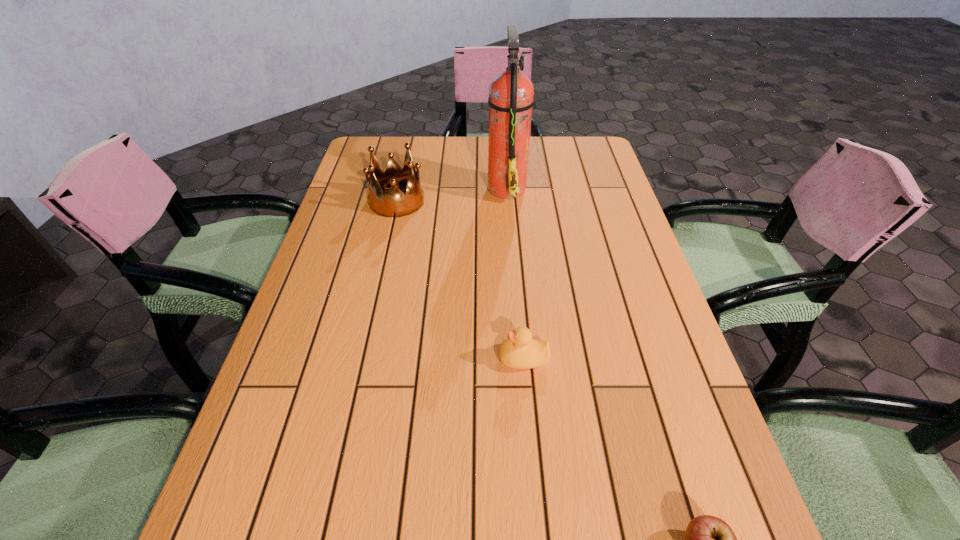
Identify the location of free space located 0.230m on the face of the duck. The width and height of the screenshot is (960, 540). (384, 358).

Image resolution: width=960 pixels, height=540 pixels. What are the coordinates of `object that is at the far edge` in the screenshot? It's located at (511, 93).

Find the location of a particular element. This screenshot has height=540, width=960. object that is at the left edge is located at coordinates (395, 204).

The height and width of the screenshot is (540, 960). In the image, there is a desktop. What are the coordinates of `vacant space at the far edge` in the screenshot? It's located at (429, 150).

This screenshot has height=540, width=960. Identify the location of free space at the left edge of the desktop. (352, 182).

Where is `vacant space at the right edge`? Image resolution: width=960 pixels, height=540 pixels. vacant space at the right edge is located at coordinates (623, 226).

Find the location of a particular element. The width and height of the screenshot is (960, 540). vacant space at the far right corner is located at coordinates (561, 162).

Identify the location of free spot between the tallest object and the duck. The image size is (960, 540). (515, 273).

Locate an element on the screen. The height and width of the screenshot is (540, 960). empty space between the crown and the fire extinguisher is located at coordinates (452, 194).

What are the coordinates of `vacant area that lies between the second nearest object and the tallest object` in the screenshot? It's located at (515, 273).